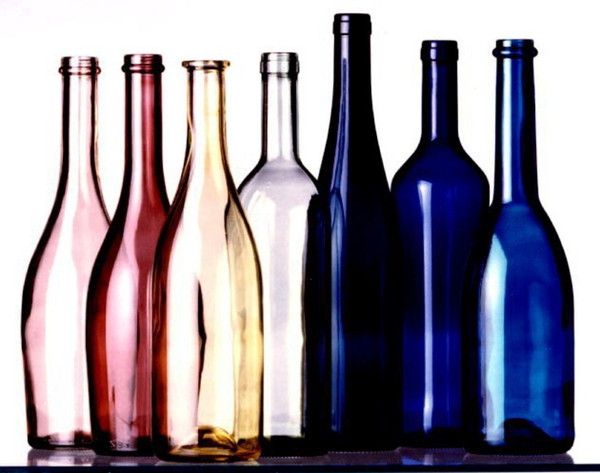
Identify the location of bottles. The image size is (600, 473). (76, 224), (144, 207), (204, 206), (277, 196), (348, 237), (441, 240), (525, 269).